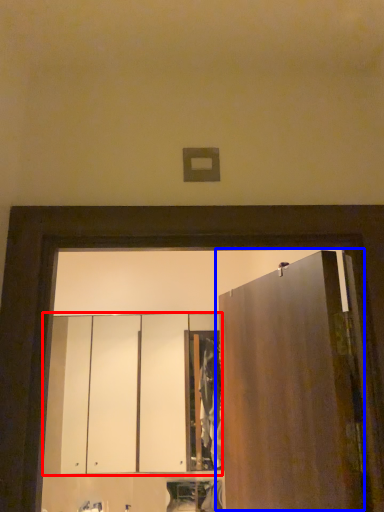
Question: Which object is further to the camera taking this photo, cabinetry (highlighted by a red box) or door (highlighted by a blue box)?

Choices:
 (A) cabinetry
 (B) door

Answer: (A)